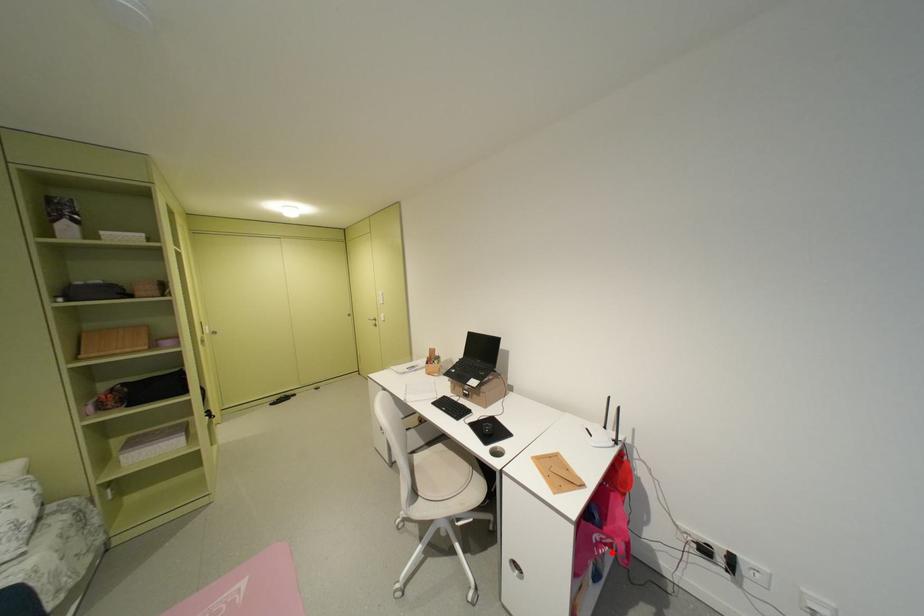
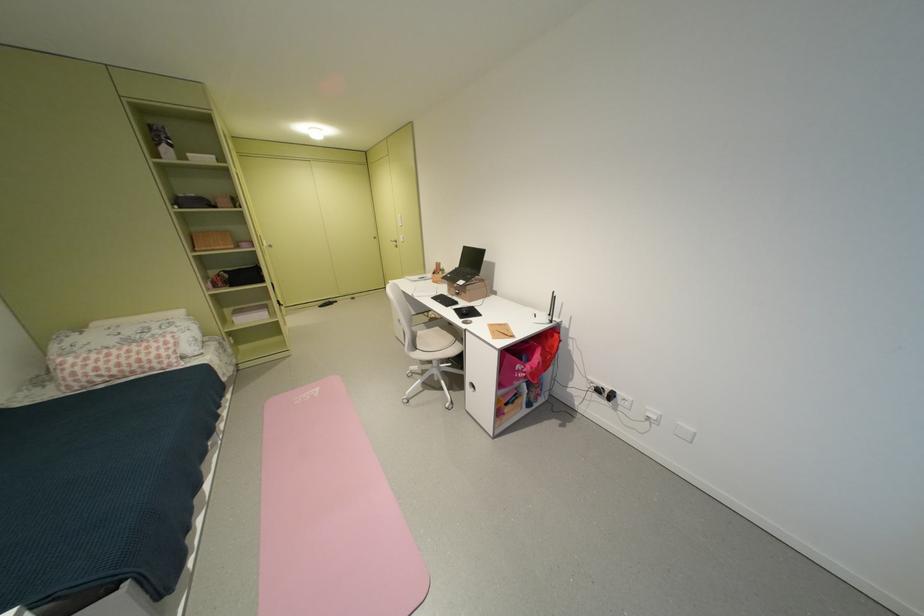
Locate, in the second image, the point that corresponds to the highlighted location in the first image.

(530, 376)